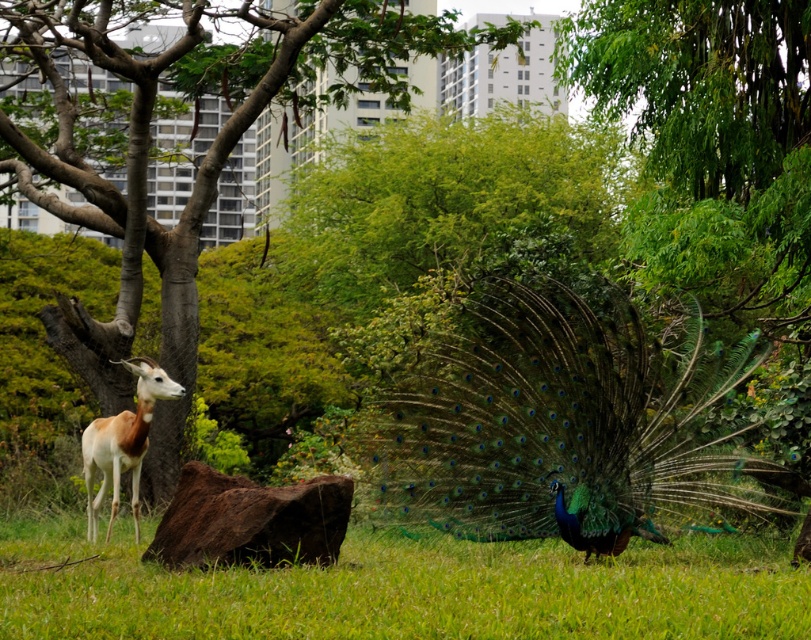
Question: Estimate the real-world distances between objects in this image. Which object is closer to the smooth bark tree at center?

Choices:
 (A) green grassy at lower center
 (B) white glossy antelope at left

Answer: (B)

Question: From the image, what is the correct spatial relationship of shiny green peacock at center in relation to green grassy at lower center?

Choices:
 (A) below
 (B) above

Answer: (B)

Question: Considering the real-world distances, which object is closest to the smooth bark tree at center?

Choices:
 (A) shiny green peacock at center
 (B) green grassy at lower center

Answer: (A)

Question: Does smooth bark tree at center have a greater width compared to green grassy at lower center?

Choices:
 (A) yes
 (B) no

Answer: (A)

Question: Is shiny green peacock at center smaller than smooth bark tree at center?

Choices:
 (A) no
 (B) yes

Answer: (B)

Question: Among these objects, which one is nearest to the camera?

Choices:
 (A) green grassy at lower center
 (B) shiny green peacock at center
 (C) smooth bark tree at center

Answer: (A)